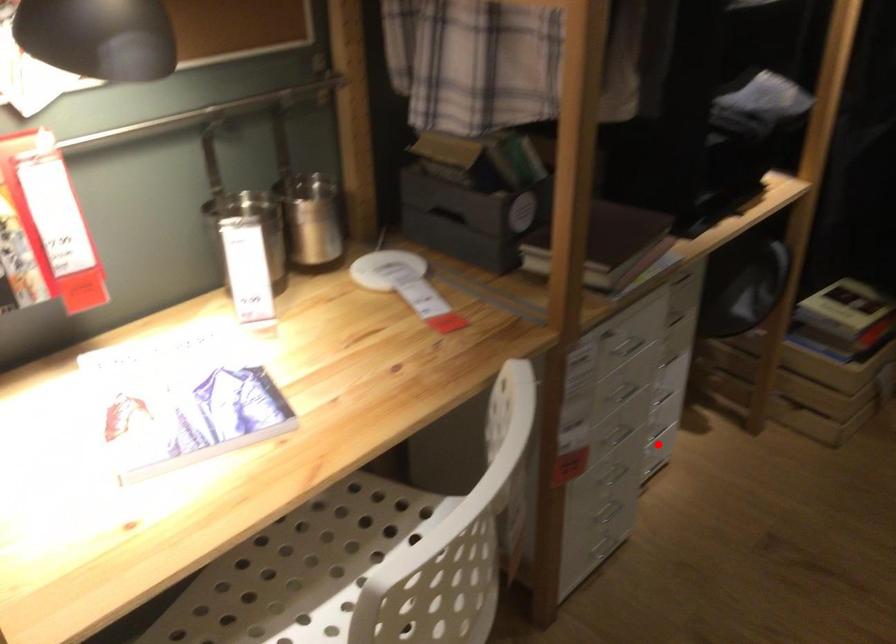
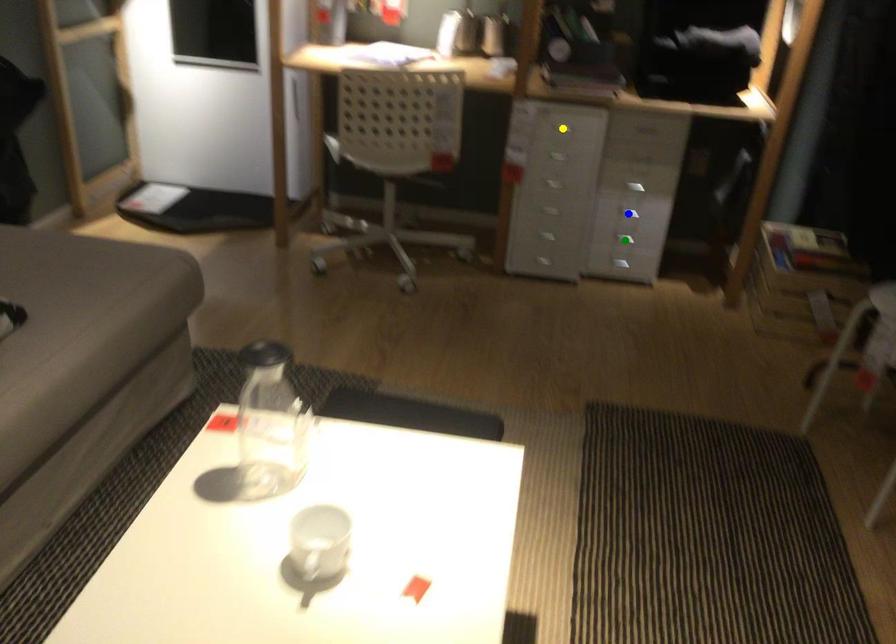
Question: I am providing you with two images of the same scene from different viewpoints. A red point is marked on the first image. You are given multiple points on the second image. Which mark in image 2 goes with the point in image 1?

Choices:
 (A) yellow point
 (B) blue point
 (C) green point

Answer: (C)